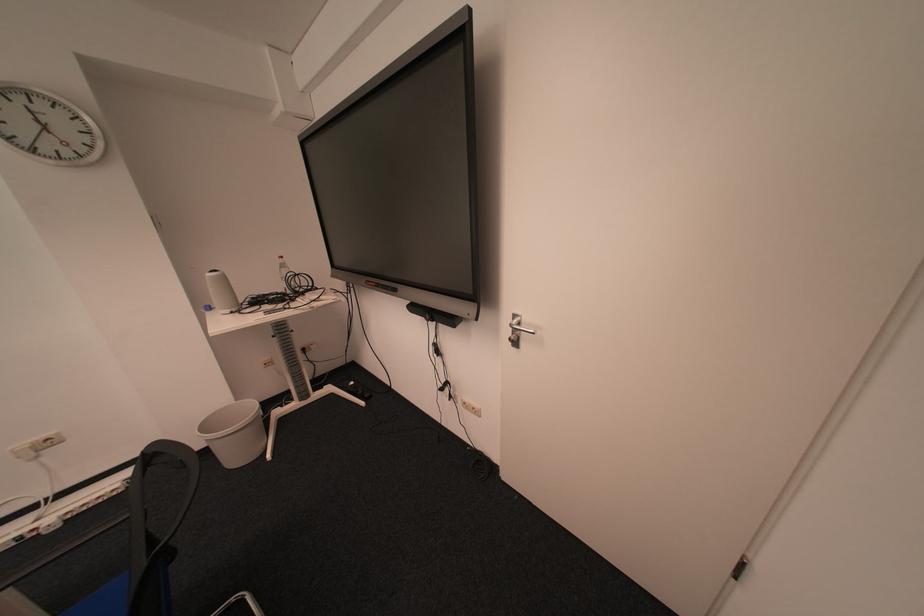
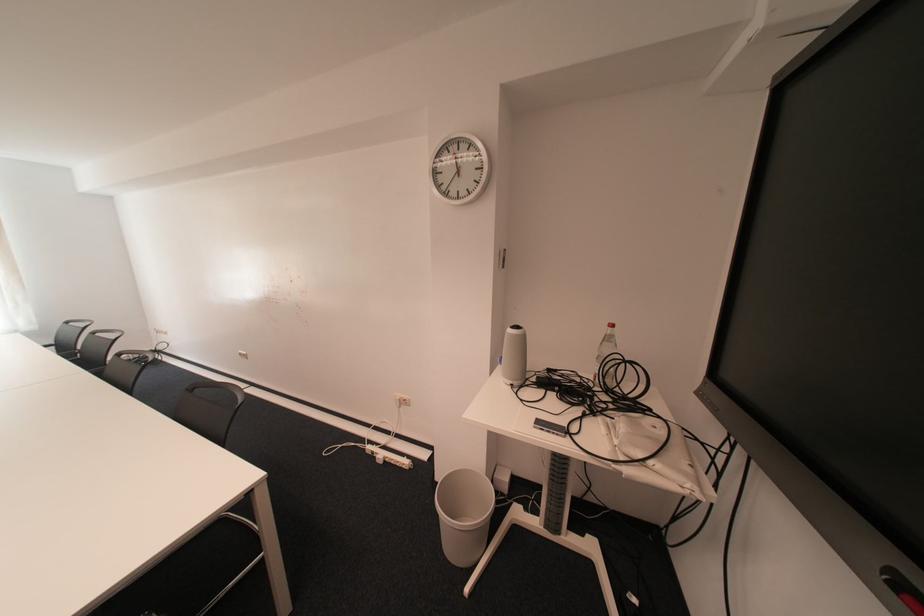
Where in the second image is the point corresponding to pixel 44 151 from the first image?

(457, 195)